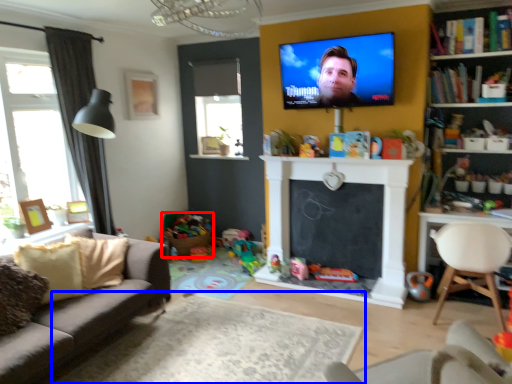
Question: Which point is further to the camera, toy (highlighted by a red box) or plain (highlighted by a blue box)?

Choices:
 (A) toy
 (B) plain

Answer: (A)